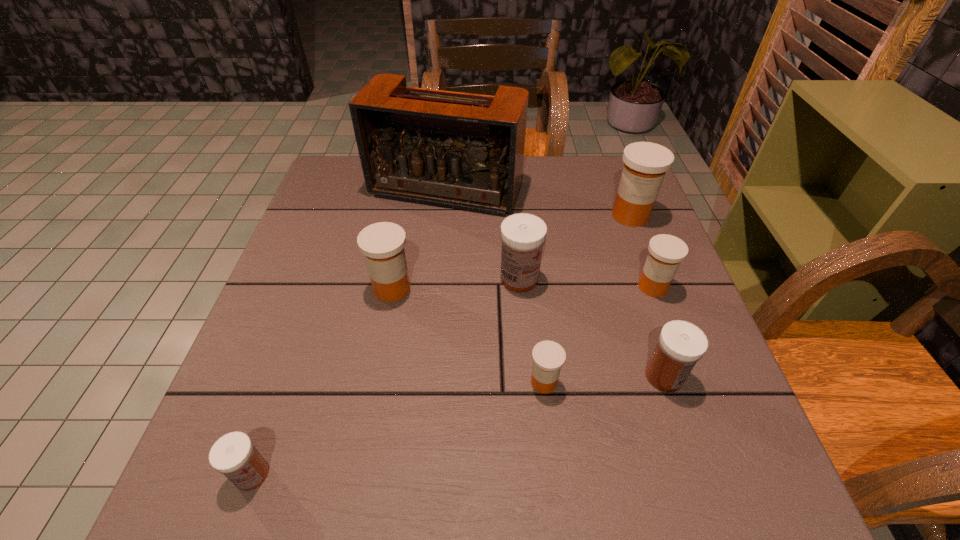
In order to click on object positioned at the near left corner in this screenshot , I will do `click(234, 455)`.

Identify the location of object present at the far right corner. (645, 164).

Find the location of a particular element. Image resolution: width=960 pixels, height=540 pixels. vacant area at the far edge is located at coordinates (577, 198).

The height and width of the screenshot is (540, 960). Find the location of `vacant space at the near edge of the desktop`. vacant space at the near edge of the desktop is located at coordinates [295, 495].

I want to click on vacant space at the left edge, so click(x=317, y=245).

In the image, there is a desktop. What are the coordinates of `vacant space at the right edge` in the screenshot? It's located at (700, 323).

The width and height of the screenshot is (960, 540). In order to click on vacant space at the far left corner of the desktop in this screenshot , I will do `click(360, 202)`.

The height and width of the screenshot is (540, 960). In the image, there is a desktop. Find the location of `vacant space at the near left corner`. vacant space at the near left corner is located at coordinates (268, 452).

Where is `vacant space that is in between the second tallest object and the second smallest orange medicine`? Image resolution: width=960 pixels, height=540 pixels. vacant space that is in between the second tallest object and the second smallest orange medicine is located at coordinates (641, 251).

Locate an element on the screen. This screenshot has width=960, height=540. free space between the nearest object and the second biggest orange medicine is located at coordinates (322, 381).